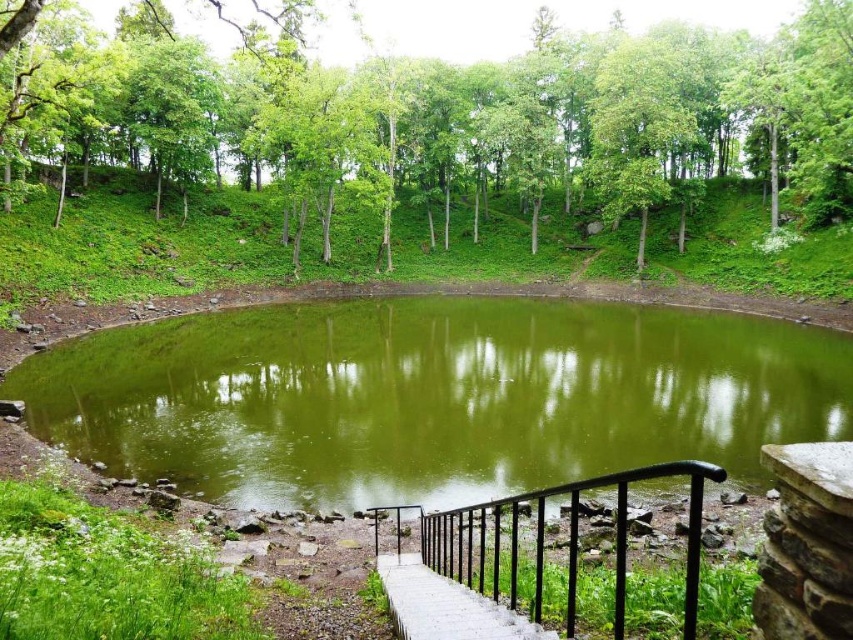
Question: Which of the following is the farthest from the observer?

Choices:
 (A) (799, 81)
 (B) (689, 493)

Answer: (A)

Question: Is green leafy tree at upper center below black metal railing at lower center?

Choices:
 (A) no
 (B) yes

Answer: (A)

Question: Is green water at center above black metal railing at lower center?

Choices:
 (A) no
 (B) yes

Answer: (B)

Question: Is green water at center above green leafy tree at upper center?

Choices:
 (A) yes
 (B) no

Answer: (B)

Question: Which of the following is the closest to the observer?

Choices:
 (A) (480, 356)
 (B) (45, 154)

Answer: (A)

Question: Which of the following is the closest to the observer?

Choices:
 (A) (62, 420)
 (B) (697, 161)

Answer: (A)